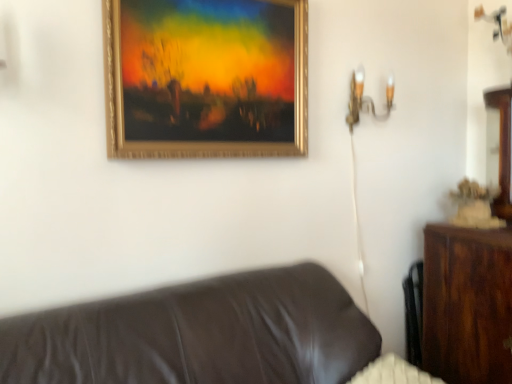
Question: Does brown leather couch at lower left have a greater height compared to gold metallic picture frame at upper center?

Choices:
 (A) yes
 (B) no

Answer: (B)

Question: Is gold metallic picture frame at upper center completely or partially inside brown leather couch at lower left?

Choices:
 (A) no
 (B) yes

Answer: (A)

Question: Is brown leather couch at lower left far from gold metallic picture frame at upper center?

Choices:
 (A) no
 (B) yes

Answer: (A)

Question: Is brown leather couch at lower left outside of gold metallic picture frame at upper center?

Choices:
 (A) no
 (B) yes

Answer: (B)

Question: Is brown leather couch at lower left to the right of gold metallic picture frame at upper center from the viewer's perspective?

Choices:
 (A) no
 (B) yes

Answer: (B)

Question: In terms of width, does gold metallic wall sconce at upper right look wider or thinner when compared to brown leather couch at lower left?

Choices:
 (A) thin
 (B) wide

Answer: (A)

Question: From a real-world perspective, is gold metallic wall sconce at upper right positioned above or below brown leather couch at lower left?

Choices:
 (A) above
 (B) below

Answer: (A)

Question: Is gold metallic wall sconce at upper right bigger or smaller than brown leather couch at lower left?

Choices:
 (A) big
 (B) small

Answer: (B)

Question: From the image's perspective, relative to brown leather couch at lower left, is gold metallic wall sconce at upper right above or below?

Choices:
 (A) below
 (B) above

Answer: (B)

Question: In terms of height, does gold metallic wall sconce at upper right look taller or shorter compared to gold metallic picture frame at upper center?

Choices:
 (A) short
 (B) tall

Answer: (A)

Question: Looking at their shapes, would you say gold metallic wall sconce at upper right is wider or thinner than gold metallic picture frame at upper center?

Choices:
 (A) thin
 (B) wide

Answer: (B)

Question: Does point (352, 117) appear closer or farther from the camera than point (238, 86)?

Choices:
 (A) closer
 (B) farther

Answer: (B)

Question: From a real-world perspective, is gold metallic wall sconce at upper right physically located above or below gold metallic picture frame at upper center?

Choices:
 (A) above
 (B) below

Answer: (B)

Question: Considering their positions, is brown leather couch at lower left located in front of or behind gold metallic picture frame at upper center?

Choices:
 (A) front
 (B) behind

Answer: (A)

Question: Considering the positions of brown leather couch at lower left and gold metallic picture frame at upper center in the image, is brown leather couch at lower left taller or shorter than gold metallic picture frame at upper center?

Choices:
 (A) short
 (B) tall

Answer: (A)